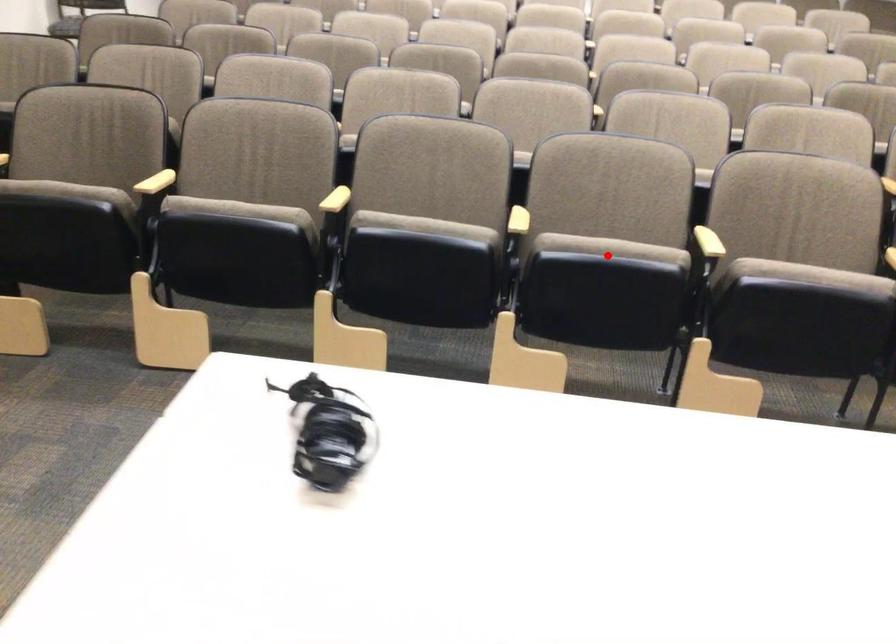
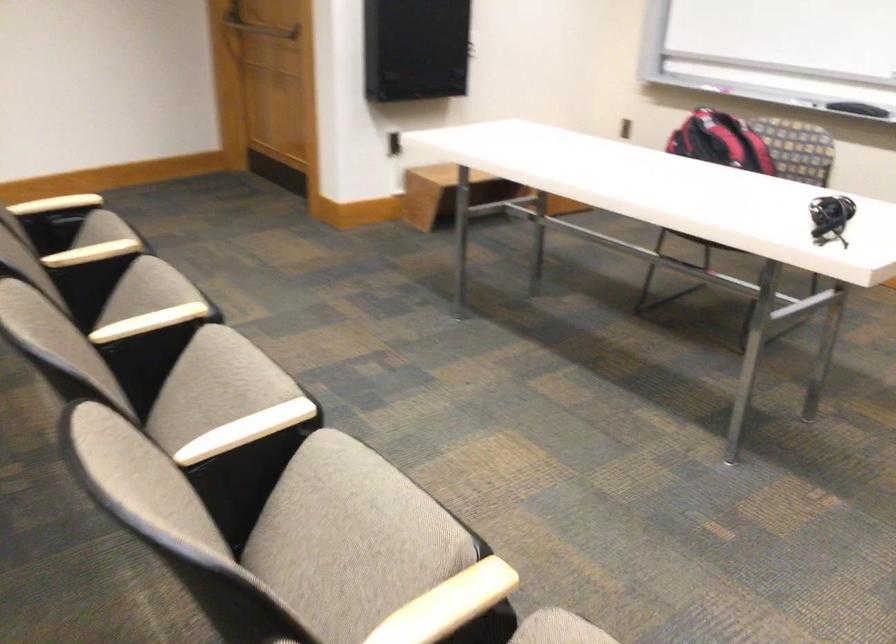
In the second image, find the point that corresponds to the highlighted location in the first image.

(214, 386)